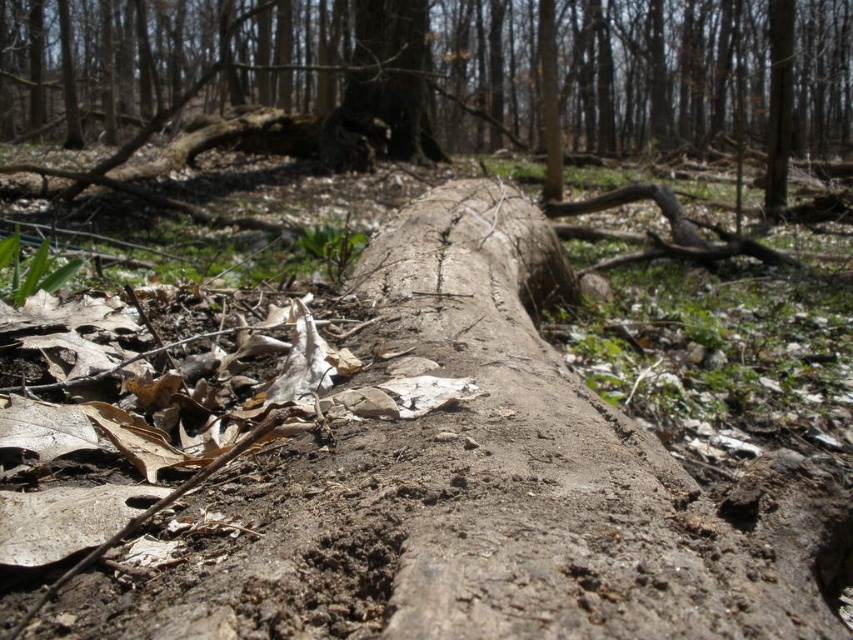
You are a hiker trying to cross the forest floor. You see two logs at the center of the image, the smooth bark log at center and the smooth brown log at center. Which log is higher above the ground?

The smooth bark log at center is taller than the smooth brown log at center, so it is higher above the ground.

You are a forest researcher who needs to locate the smooth bark log at center. According to the coordinates provided, where exactly should you look in the image?

The smooth bark log at center is located at point (701, 72) in the image.

You are a hiker navigating through the forest and want to place a marker at the point that is closer to you. Which point should you choose between point (50, 1) and point (352, 97)?

Point (50, 1) is further to the viewer than point (352, 97). Therefore, the closer point to you is point (352, 97).